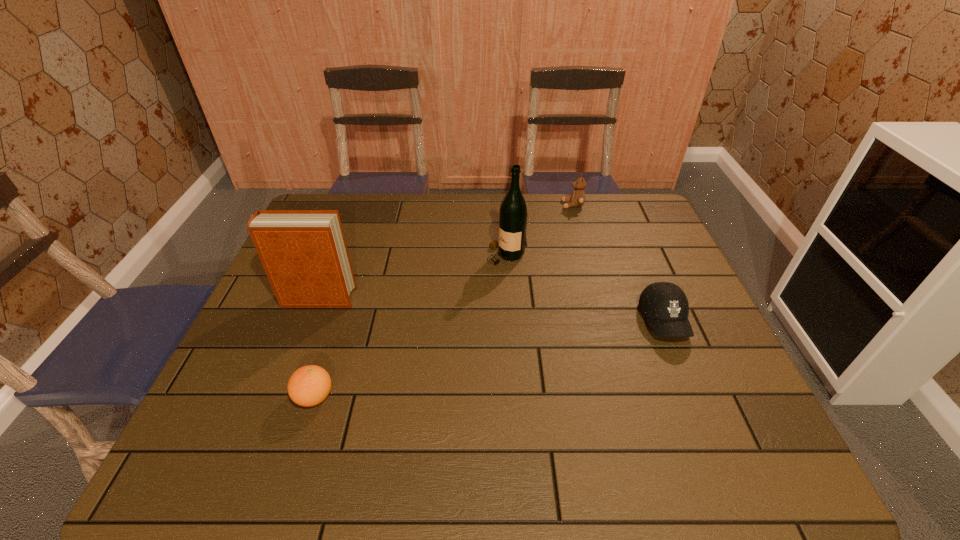
This screenshot has height=540, width=960. I want to click on the second farthest object, so click(x=513, y=215).

Find the location of `wine bottle`. wine bottle is located at coordinates [513, 215].

Locate an element on the screen. hardback book is located at coordinates (304, 253).

Where is `the third shortest object`? This screenshot has width=960, height=540. the third shortest object is located at coordinates (577, 199).

Image resolution: width=960 pixels, height=540 pixels. In order to click on the second object from right to left in this screenshot , I will do `click(577, 199)`.

This screenshot has width=960, height=540. What are the coordinates of `the rightmost object` in the screenshot? It's located at (665, 305).

The height and width of the screenshot is (540, 960). In order to click on orange in this screenshot , I will do `click(309, 385)`.

This screenshot has width=960, height=540. I want to click on vacant space positioned on the surface of the fourth nearest object, so click(464, 255).

This screenshot has width=960, height=540. In order to click on free region located on the surface of the fourth nearest object in this screenshot , I will do `click(382, 255)`.

Image resolution: width=960 pixels, height=540 pixels. I want to click on blank space located 0.320m on the surface of the fourth nearest object, so click(x=382, y=255).